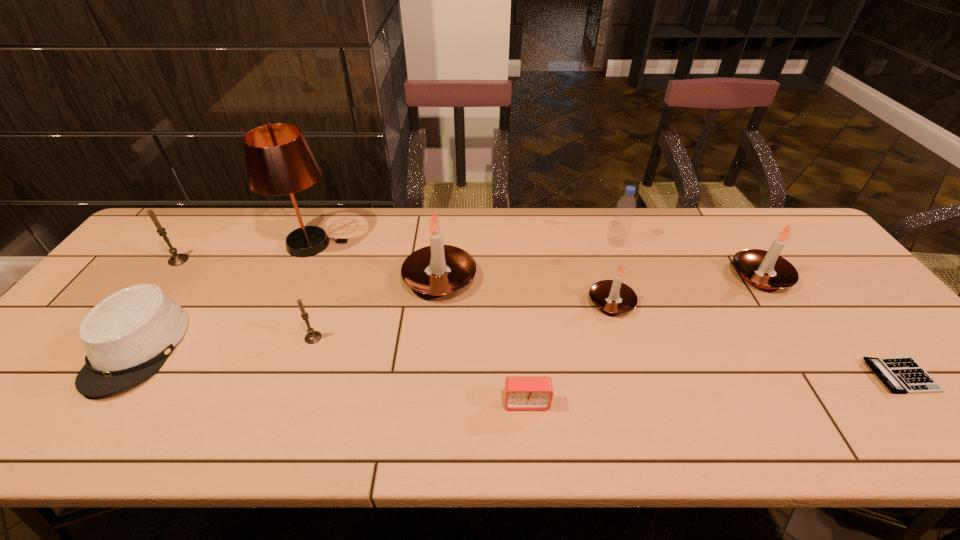
Locate an element on the screen. object that is the third closest to the nearest candle is located at coordinates (128, 336).

Image resolution: width=960 pixels, height=540 pixels. Find the location of `the closest candle to the sixth object from left to right`. the closest candle to the sixth object from left to right is located at coordinates (602, 293).

Identify which candle is the third closest to the hat. Please provide its 2D coordinates. Your answer should be formatted as a tuple, i.e. [(x, y)], where the tuple contains the x and y coordinates of a point satisfying the conditions above.

[(438, 269)]

Locate which white candle is the third closest to the left gray candle. Please provide its 2D coordinates. Your answer should be formatted as a tuple, i.e. [(x, y)], where the tuple contains the x and y coordinates of a point satisfying the conditions above.

[(752, 264)]

Point out which white candle is positioned as the nearest to the nearer gray candle. Please provide its 2D coordinates. Your answer should be formatted as a tuple, i.e. [(x, y)], where the tuple contains the x and y coordinates of a point satisfying the conditions above.

[(438, 269)]

The image size is (960, 540). What are the coordinates of `blank space that satisfies the following two spatial constraints: 1. on the front-facing side of the leftmost white candle; 2. on the left side of the tallest object` in the screenshot? It's located at (297, 279).

You are a GUI agent. You are given a task and a screenshot of the screen. Output one action in this format:
    pyautogui.click(x=<x>, y=<y>)
    Task: Click on the free space that satisfies the following two spatial constraints: 1. on the front-facing side of the second candle from right to left; 2. on the left side of the tallest object
    Image resolution: width=960 pixels, height=540 pixels.
    Given the screenshot: What is the action you would take?
    pyautogui.click(x=286, y=302)

Find the location of a particular element. free space that satisfies the following two spatial constraints: 1. on the front-facing side of the lampshade; 2. on the front-facing side of the hat is located at coordinates (265, 348).